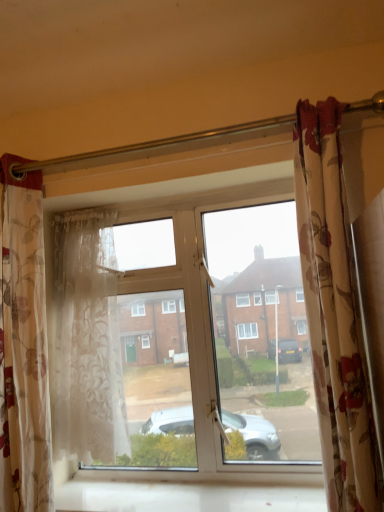
Question: Can you confirm if sheer floral fabric curtain at left, which is the second curtain in right-to-left order, is bigger than translucent floral fabric curtain at left, placed as the 3th curtain when sorted from right to left?

Choices:
 (A) yes
 (B) no

Answer: (B)

Question: Can you confirm if sheer floral fabric curtain at left, which ranks as the second curtain in left-to-right order, is smaller than translucent floral fabric curtain at left, acting as the first curtain starting from the left?

Choices:
 (A) yes
 (B) no

Answer: (A)

Question: From the image's perspective, is sheer floral fabric curtain at left, which ranks as the second curtain in left-to-right order, located above translucent floral fabric curtain at left, placed as the 3th curtain when sorted from right to left?

Choices:
 (A) no
 (B) yes

Answer: (A)

Question: Could you tell me if sheer floral fabric curtain at left, which ranks as the second curtain in left-to-right order, is facing translucent floral fabric curtain at left, placed as the 3th curtain when sorted from right to left?

Choices:
 (A) yes
 (B) no

Answer: (A)

Question: Is sheer floral fabric curtain at left, which is the second curtain in right-to-left order, looking in the opposite direction of translucent floral fabric curtain at left, placed as the 3th curtain when sorted from right to left?

Choices:
 (A) no
 (B) yes

Answer: (A)

Question: In the image, is translucent floral fabric curtain at left, placed as the 3th curtain when sorted from right to left, positioned in front of or behind floral fabric curtain at right, acting as the third curtain starting from the left?

Choices:
 (A) front
 (B) behind

Answer: (B)

Question: From the image's perspective, relative to floral fabric curtain at right, acting as the third curtain starting from the left, is translucent floral fabric curtain at left, placed as the 3th curtain when sorted from right to left, above or below?

Choices:
 (A) below
 (B) above

Answer: (A)

Question: Is translucent floral fabric curtain at left, acting as the first curtain starting from the left, taller or shorter than floral fabric curtain at right, the first curtain viewed from the right?

Choices:
 (A) tall
 (B) short

Answer: (A)

Question: From a real-world perspective, is translucent floral fabric curtain at left, placed as the 3th curtain when sorted from right to left, positioned above or below floral fabric curtain at right, acting as the third curtain starting from the left?

Choices:
 (A) below
 (B) above

Answer: (A)

Question: Is white smooth window sill at lower center in front of or behind floral fabric curtain at right, the first curtain viewed from the right, in the image?

Choices:
 (A) front
 (B) behind

Answer: (B)

Question: From the image's perspective, is white smooth window sill at lower center located above or below floral fabric curtain at right, the first curtain viewed from the right?

Choices:
 (A) above
 (B) below

Answer: (B)

Question: Considering the positions of point 180,485 and point 316,364, is point 180,485 closer or farther from the camera than point 316,364?

Choices:
 (A) farther
 (B) closer

Answer: (A)

Question: Would you say white smooth window sill at lower center is inside or outside floral fabric curtain at right, acting as the third curtain starting from the left?

Choices:
 (A) inside
 (B) outside

Answer: (B)

Question: From a real-world perspective, relative to translucent floral fabric curtain at left, placed as the 3th curtain when sorted from right to left, is transparent glass window at center vertically above or below?

Choices:
 (A) below
 (B) above

Answer: (A)

Question: Is transparent glass window at center in front of or behind translucent floral fabric curtain at left, placed as the 3th curtain when sorted from right to left, in the image?

Choices:
 (A) behind
 (B) front

Answer: (A)